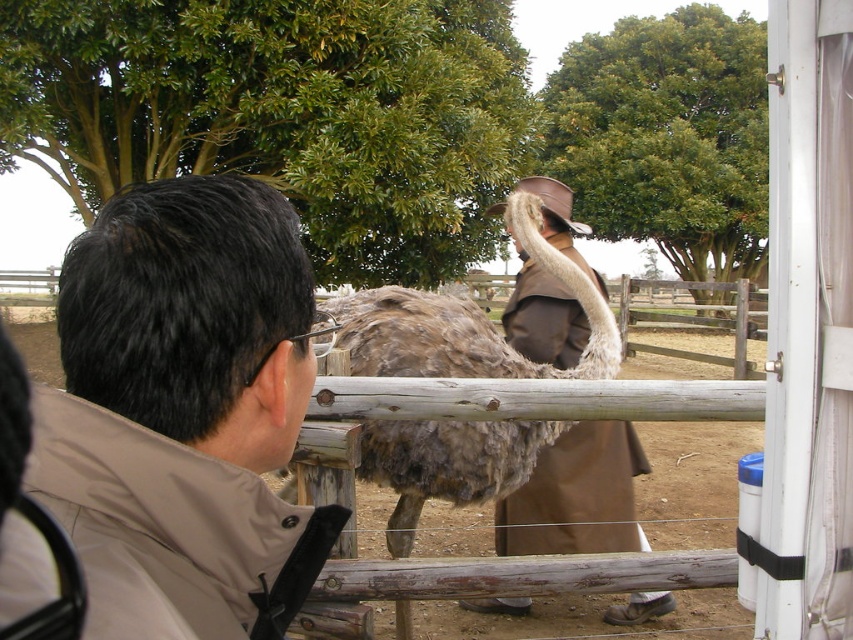
Question: Which point is closer to the camera?

Choices:
 (A) (79, 484)
 (B) (614, 348)
 (C) (480, 608)

Answer: (A)

Question: Which point is farther to the camera?

Choices:
 (A) (215, 291)
 (B) (595, 529)
 (C) (386, 448)

Answer: (B)

Question: Which object is closer to the camera taking this photo?

Choices:
 (A) gray-brown feathered ostrich at center
 (B) brown leather trench coat at center
 (C) brown matte jacket at upper left

Answer: (C)

Question: Can you confirm if brown matte jacket at upper left is positioned below gray-brown feathered ostrich at center?

Choices:
 (A) yes
 (B) no

Answer: (A)

Question: Can you confirm if gray-brown feathered ostrich at center is bigger than brown leather trench coat at center?

Choices:
 (A) yes
 (B) no

Answer: (A)

Question: Does gray-brown feathered ostrich at center have a greater width compared to brown leather trench coat at center?

Choices:
 (A) no
 (B) yes

Answer: (B)